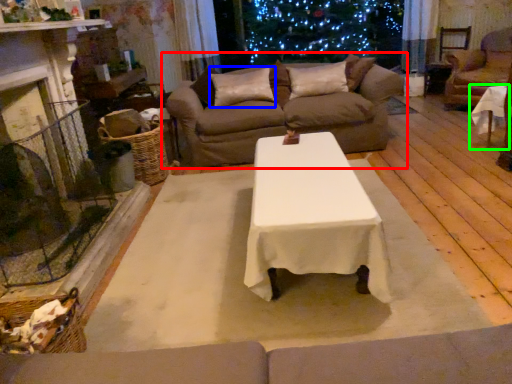
Question: Which is nearer to the studio couch (highlighted by a red box)? pillow (highlighted by a blue box) or table (highlighted by a green box).

Choices:
 (A) pillow
 (B) table

Answer: (A)